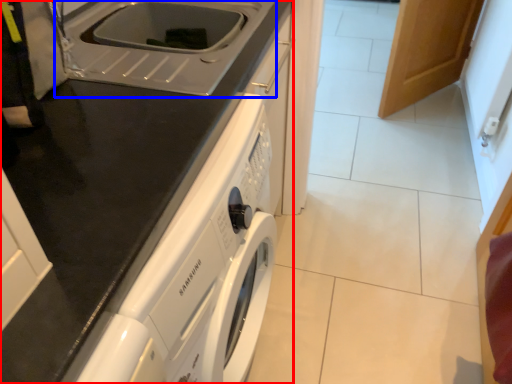
Question: Which of the following is the farthest to the observer, home appliance (highlighted by a red box) or sink (highlighted by a blue box)?

Choices:
 (A) home appliance
 (B) sink

Answer: (B)